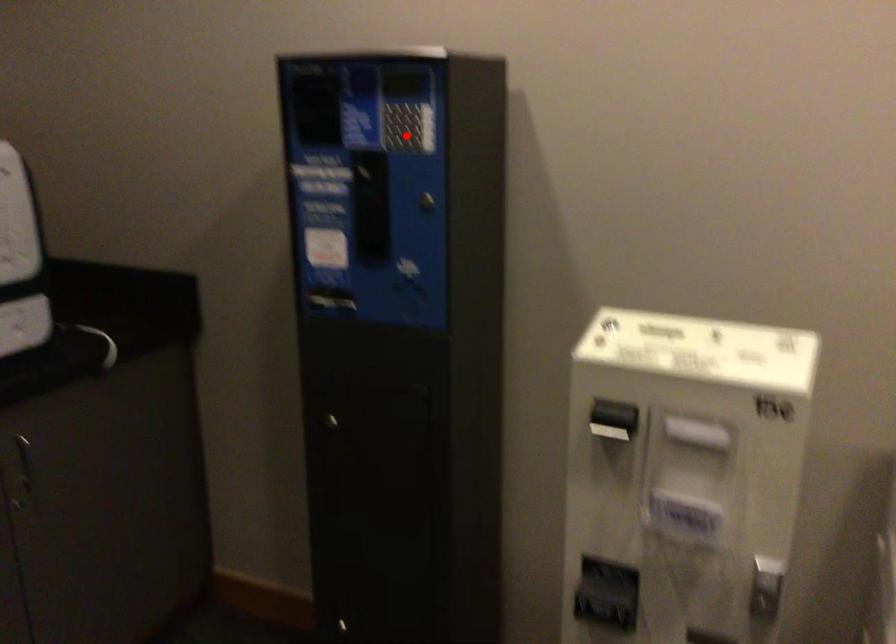
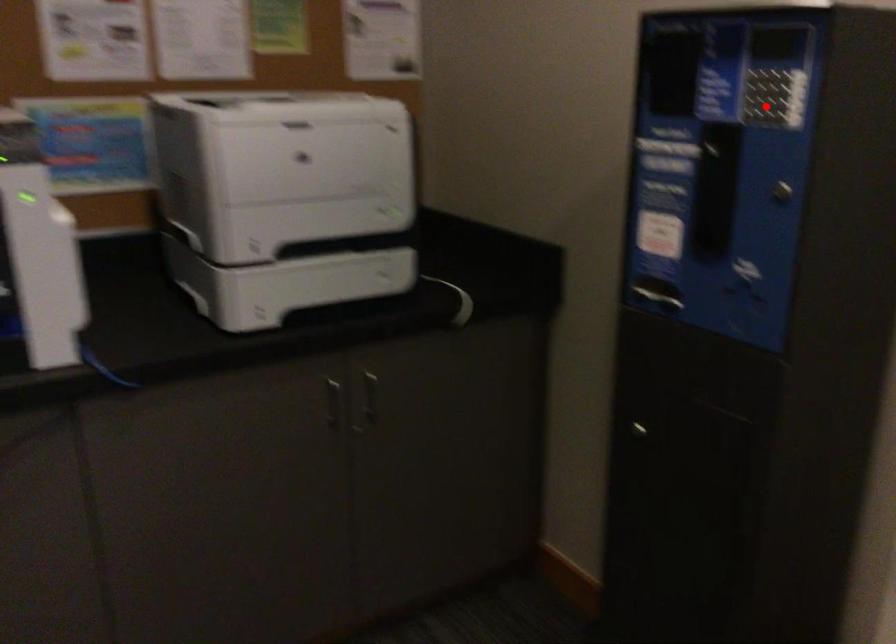
I am providing you with two images of the same scene from different viewpoints. A red point is marked on the first image and another point is marked on the second image. Does the point marked in image1 correspond to the same location as the one in image2?

Yes